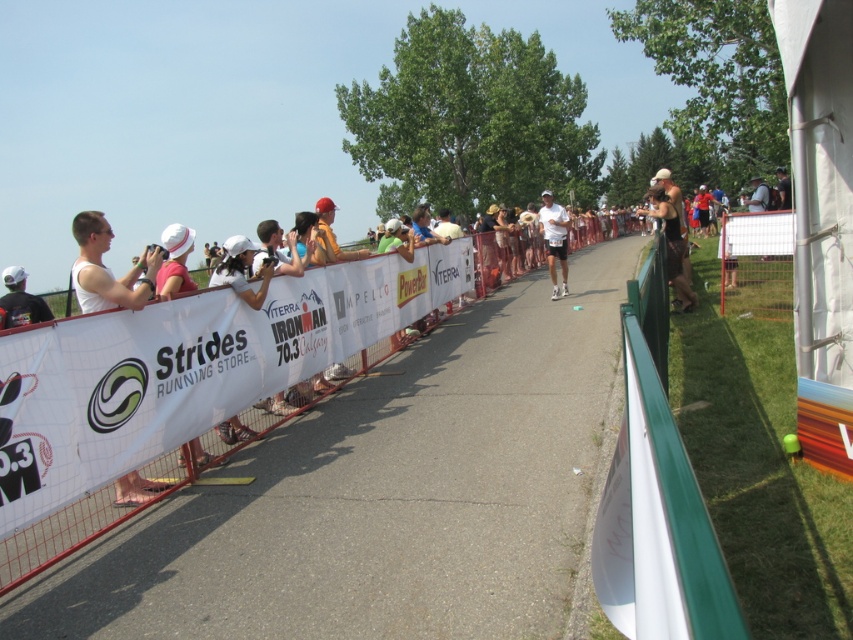
You are a photographer positioned at the center of the scene. You want to capture a photo that includes both the matte black helmet at upper right and the black matte backpack at left. Which object should you adjust your camera angle upwards to include?

The matte black helmet at upper right is above the black matte backpack at left, so you should adjust your camera angle upwards to include the matte black helmet at upper right.

You are a drone operator trying to capture aerial footage of the runner in the race. You have two points marked on your screen for positioning the drone. The first point is at coordinates point (682, 301) and the second point is at point (18, 272). Which point should you choose to ensure the drone stays above the runner while avoiding the crowd of spectators behind?

Point (18, 272) should be chosen because point (682, 301) is behind point (18, 272), meaning the latter is closer to the runner and farther from the spectators.

From the picture: You are a photographer positioned at the starting line of the race. You want to capture a photo of the runner while ensuring both the matte black helmet at upper right and the black matte backpack at left are visible in the frame. Which object should you focus on first to ensure both are in the shot?

The matte black helmet at upper right is taller than the black matte backpack at left, so focusing on the matte black helmet at upper right first will ensure both objects are within the frame.